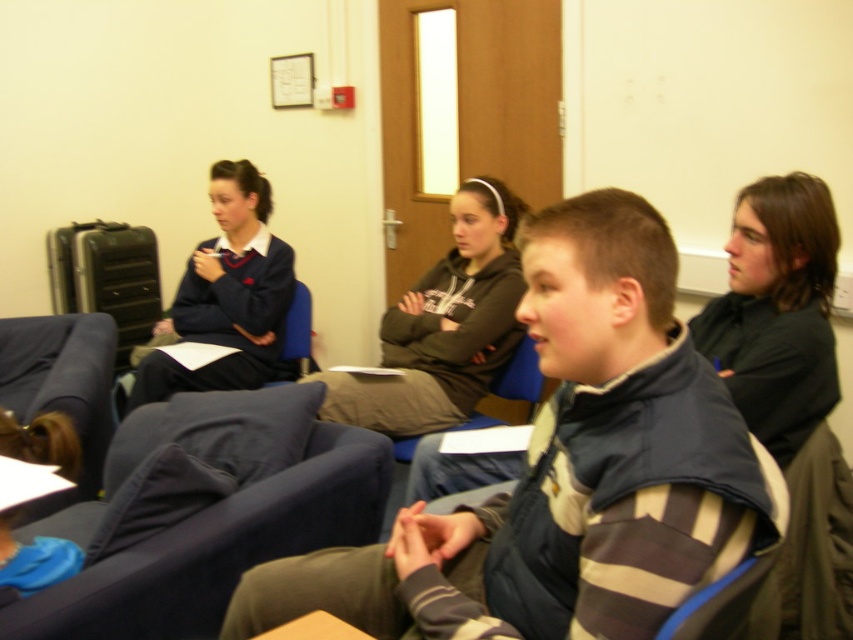
Who is higher up, black shirt at right or matte blue uniform at left?

Positioned higher is matte blue uniform at left.

Between black shirt at right and matte blue uniform at left, which one is positioned lower?

black shirt at right is below.

Which is in front, point (775, 221) or point (242, 173)?

Point (775, 221) is more forward.

This screenshot has width=853, height=640. Find the location of `black shirt at right`. black shirt at right is located at coordinates (776, 310).

Can you confirm if striped fleece jacket at center is positioned below matte blue uniform at left?

Yes, striped fleece jacket at center is below matte blue uniform at left.

Does point (462, 620) come closer to viewer compared to point (216, 164)?

Yes, it is.

Is point (490, 566) farther from camera compared to point (207, 314)?

That is False.

The height and width of the screenshot is (640, 853). Identify the location of striped fleece jacket at center. (566, 472).

Which is above, striped fleece jacket at center or blue fabric chair at lower right?

striped fleece jacket at center is higher up.

Does striped fleece jacket at center appear over blue fabric chair at lower right?

Yes.

This screenshot has height=640, width=853. I want to click on striped fleece jacket at center, so click(566, 472).